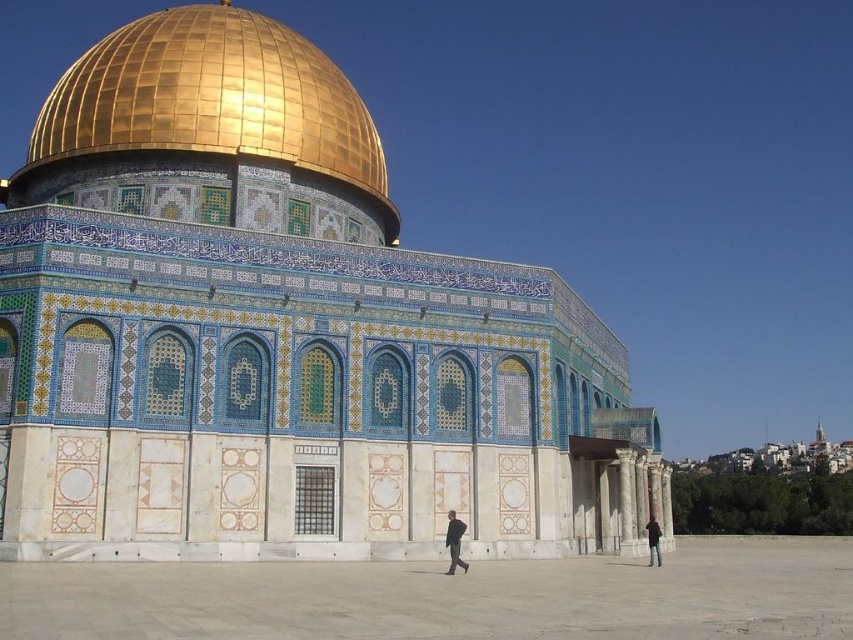
Question: Does shiny gold dome at upper center appear on the left side of dark gray suit at center?

Choices:
 (A) no
 (B) yes

Answer: (B)

Question: Is the position of dark gray suit at center more distant than that of black fabric at center?

Choices:
 (A) yes
 (B) no

Answer: (B)

Question: Can you confirm if gold polished dome at upper center is positioned above dark gray suit at center?

Choices:
 (A) yes
 (B) no

Answer: (A)

Question: Considering the real-world distances, which object is closest to the shiny gold dome at upper center?

Choices:
 (A) black fabric at center
 (B) gold polished dome at upper center
 (C) dark gray suit at center

Answer: (B)

Question: Which of the following is the farthest from the observer?

Choices:
 (A) (659, 534)
 (B) (453, 529)
 (C) (271, 131)
 (D) (260, 138)

Answer: (C)

Question: Which point is farther to the camera?

Choices:
 (A) (450, 541)
 (B) (352, 170)

Answer: (B)